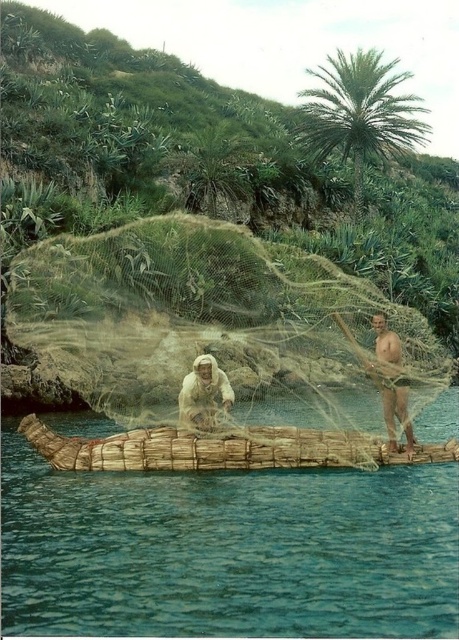
Who is more forward, (189, 492) or (40, 451)?

Positioned in front is point (189, 492).

How much distance is there between brown wooden raft at center and brown woven basket at center?

brown wooden raft at center and brown woven basket at center are 9.74 feet apart.

This screenshot has height=640, width=459. What do you see at coordinates (227, 552) in the screenshot?
I see `brown wooden raft at center` at bounding box center [227, 552].

Where is `brown wooden raft at center`? brown wooden raft at center is located at coordinates (227, 552).

Between brown woven basket at center and green leafy palm tree at upper center, which one has more height?

With more height is green leafy palm tree at upper center.

Is brown woven basket at center further to camera compared to green leafy palm tree at upper center?

No, brown woven basket at center is closer to the viewer.

Where is `brown woven basket at center`? The image size is (459, 640). brown woven basket at center is located at coordinates (224, 449).

Based on the photo, who is positioned more to the left, green mesh fishing net at center or green leafy palm tree at upper center?

green mesh fishing net at center is more to the left.

Which is more to the right, green mesh fishing net at center or green leafy palm tree at upper center?

green leafy palm tree at upper center is more to the right.

Based on the photo, who is more distant from viewer, [38,333] or [313,120]?

Point [313,120]

The height and width of the screenshot is (640, 459). What are the coordinates of `green mesh fishing net at center` in the screenshot? It's located at (202, 316).